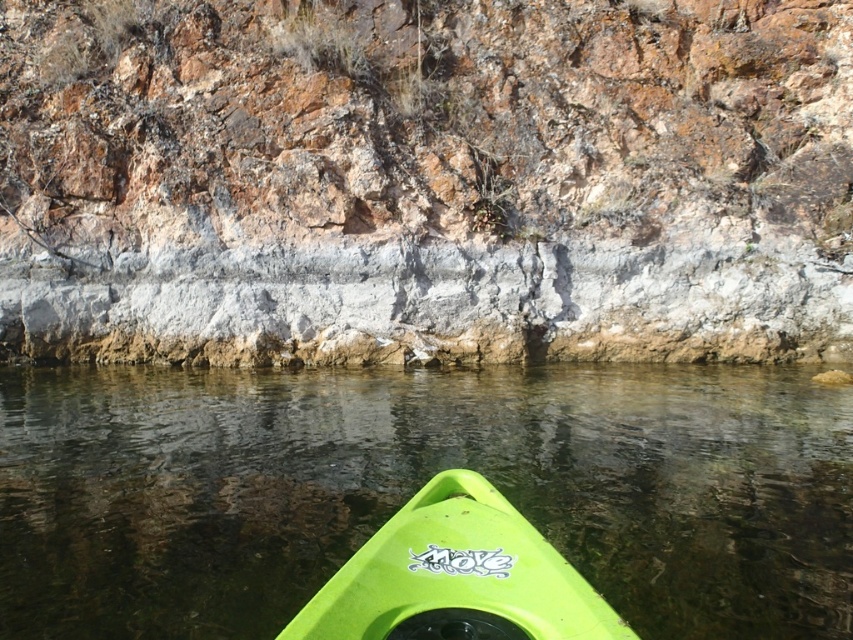
Question: Which point is closer to the camera taking this photo?

Choices:
 (A) (170, 468)
 (B) (485, 500)

Answer: (B)

Question: Which of the following is the farthest from the observer?

Choices:
 (A) rusty rock cliff at center
 (B) green matte kayak at lower center
 (C) green plastic kayak at lower center

Answer: (A)

Question: Which object is farther from the camera taking this photo?

Choices:
 (A) green matte kayak at lower center
 (B) green plastic kayak at lower center
 (C) rusty rock cliff at center

Answer: (C)

Question: Considering the relative positions of green plastic kayak at lower center and green matte kayak at lower center in the image provided, where is green plastic kayak at lower center located with respect to green matte kayak at lower center?

Choices:
 (A) above
 (B) below

Answer: (A)

Question: Does rusty rock cliff at center come in front of green plastic kayak at lower center?

Choices:
 (A) yes
 (B) no

Answer: (B)

Question: Considering the relative positions of rusty rock cliff at center and green matte kayak at lower center in the image provided, where is rusty rock cliff at center located with respect to green matte kayak at lower center?

Choices:
 (A) left
 (B) right

Answer: (B)